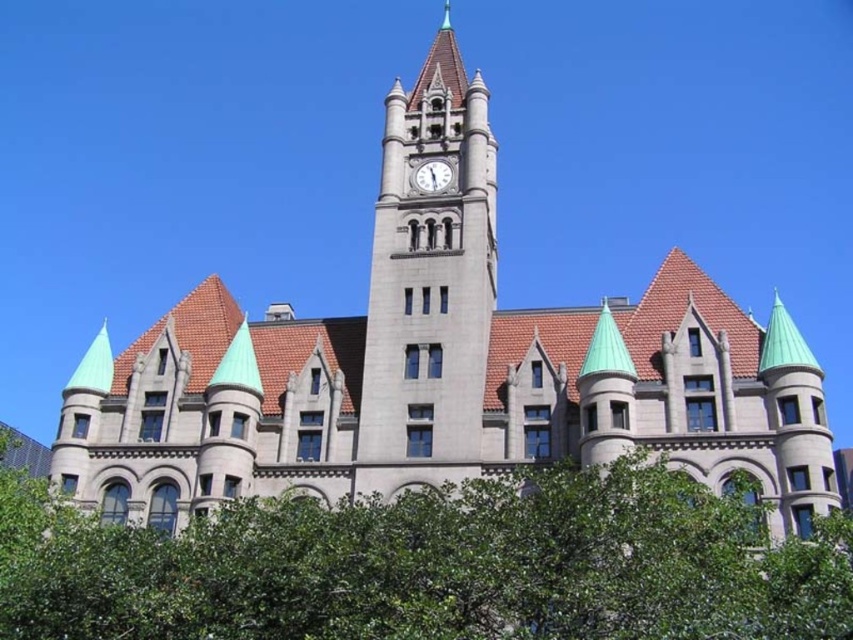
From the picture: You are standing in front of the grand historic building and notice two points marked on its facade. The first point is at coordinate point [386,355] and the second is at point [421,166]. From your perspective, which point appears closer to you?

Point [386,355] is in front of point [421,166], so it appears closer to you.

You are a maintenance worker needing to water the green leafy tree at lower center. You have a hose that can reach 15 meters. The stone clock tower at center has a water valve. Can you water the tree from the valve without moving the hose?

The green leafy tree at lower center and stone clock tower at center are 17.70 meters apart. Since the hose can only reach 15 meters, you cannot water the tree from the valve without moving the hose.